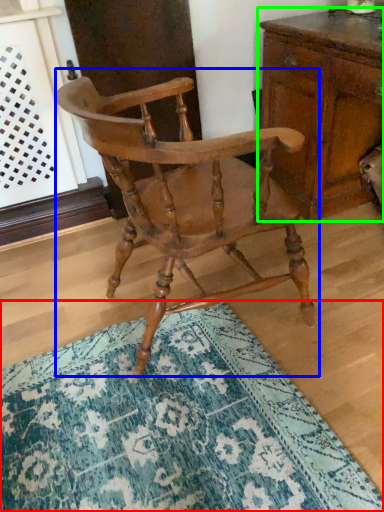
Question: Based on their relative distances, which object is nearer to doormat (highlighted by a red box)? Choose from chair (highlighted by a blue box) and chest of drawers (highlighted by a green box).

Choices:
 (A) chair
 (B) chest of drawers

Answer: (A)